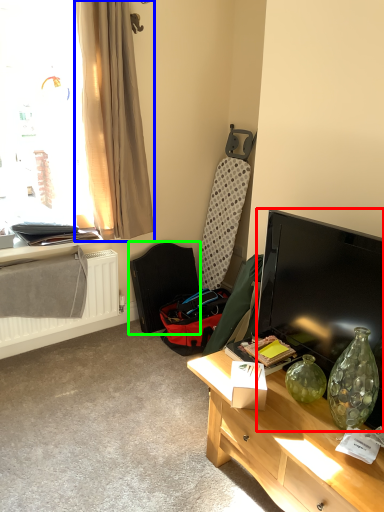
Question: Estimate the real-world distances between objects in this image. Which object is farther from television (highlighted by a red box), curtain (highlighted by a blue box) or swivel chair (highlighted by a green box)?

Choices:
 (A) curtain
 (B) swivel chair

Answer: (B)